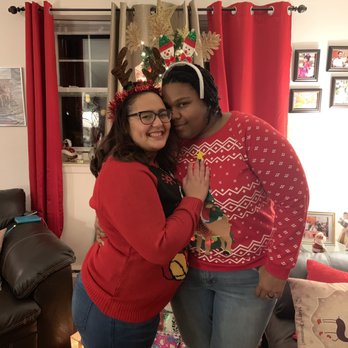
The width and height of the screenshot is (348, 348). What are the coordinates of `pillow` in the screenshot? It's located at (327, 309).